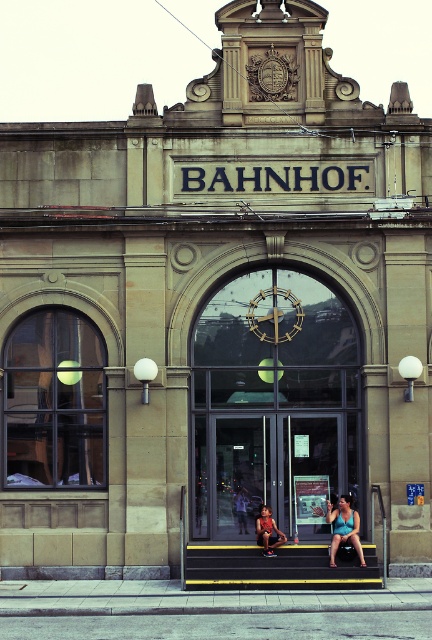
Question: Which point is farther to the camera?

Choices:
 (A) (285, 333)
 (B) (356, 531)
 (C) (263, 528)

Answer: (A)

Question: Which point is closer to the camera?

Choices:
 (A) (329, 516)
 (B) (244, 531)

Answer: (A)

Question: Considering the relative positions of yellow painted stairs at center and gold metallic clock at center in the image provided, where is yellow painted stairs at center located with respect to gold metallic clock at center?

Choices:
 (A) below
 (B) above

Answer: (A)

Question: Is yellow painted stairs at center in front of light brown leather jacket at center?

Choices:
 (A) no
 (B) yes

Answer: (B)

Question: Which is farther from the matte black shorts at center?

Choices:
 (A) gold metallic clock at center
 (B) yellow painted stairs at center
 (C) light brown leather jacket at center
 (D) matte blue tank top at center

Answer: (A)

Question: Where is matte blue tank top at center located in relation to light brown leather jacket at center in the image?

Choices:
 (A) above
 (B) below

Answer: (B)